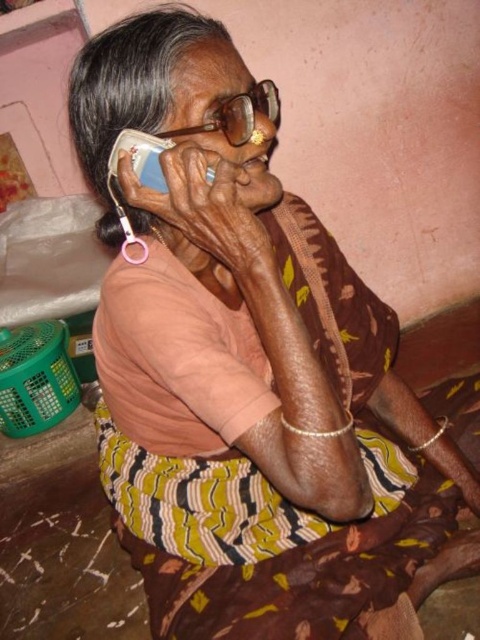
You are a delivery person who needs to place a small package between the gold textured glasses at center and the white plastic phone at upper left. The package is 3 inches long. Can you fit it between them?

The gold textured glasses at center is 3.67 inches away from the white plastic phone at upper left. Since the package is 3 inches long, it can fit between them as the space is larger than the package.

You are a photographer standing at a distance of 30 inches from the subject. You want to capture a closeup shot of the gold textured glasses at center. Is the current distance sufficient to focus on the glasses?

The gold textured glasses at center are 29.33 inches away from the camera, which is slightly closer than your current position of 30 inches. To ensure a clear focus, you should move about 0.67 inches closer to the glasses.

Consider the image. You are a photographer standing at a certain distance from the elderly woman in the image. You want to capture a closeup shot of her face without using a zoom lens. Given that the point corresponding to your current position is point (223, 122), which is 30.32 inches away from the camera, can you estimate whether you need to move closer or farther away to achieve the desired closeup?

The distance between point (223, 122) and the camera is 30.32 inches. To capture a closeup of the elderly woman without zooming, you would need to move closer than 30.32 inches to make her face appear larger in the frame.